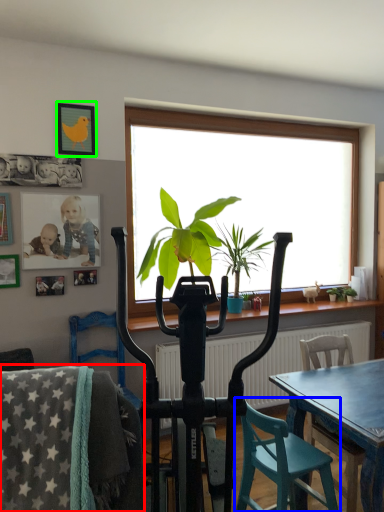
Question: Considering the real-world distances, which object is closest to chair (highlighted by a red box)? chair (highlighted by a blue box) or picture frame (highlighted by a green box).

Choices:
 (A) chair
 (B) picture frame

Answer: (A)